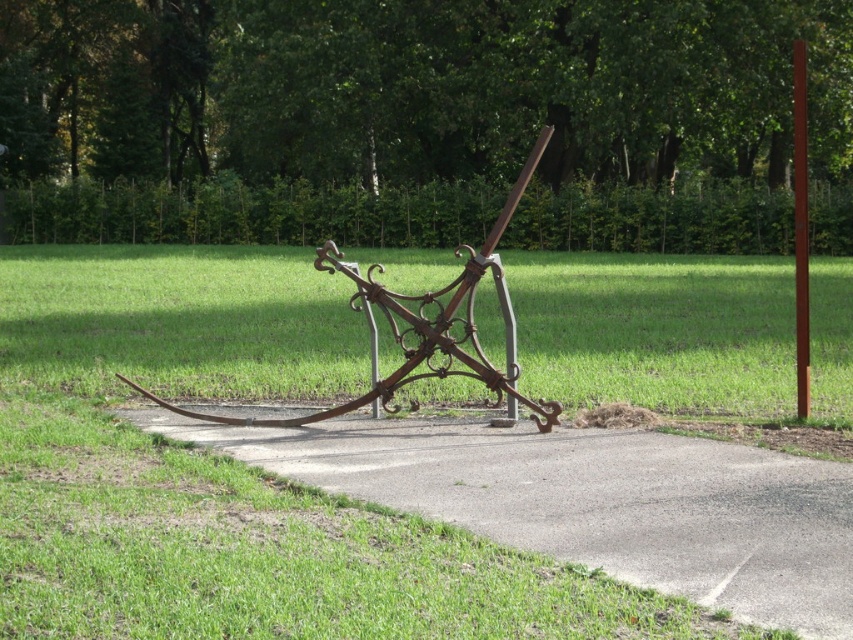
Which is more to the left, gray concrete pavement at center or smooth brown pole at right?

Positioned to the left is gray concrete pavement at center.

Does point (426, 435) come closer to viewer compared to point (795, 172)?

Yes, point (426, 435) is closer to viewer.

The image size is (853, 640). What are the coordinates of `gray concrete pavement at center` in the screenshot? It's located at (592, 500).

Is gray concrete pavement at center to the right of rusty wrought iron sculpture at center from the viewer's perspective?

Correct, you'll find gray concrete pavement at center to the right of rusty wrought iron sculpture at center.

Does gray concrete pavement at center appear over rusty wrought iron sculpture at center?

No, gray concrete pavement at center is not above rusty wrought iron sculpture at center.

Locate an element on the screen. gray concrete pavement at center is located at coordinates (592, 500).

Which of these two, rusty wrought iron sculpture at center or smooth brown pole at right, stands shorter?

With less height is rusty wrought iron sculpture at center.

Does rusty wrought iron sculpture at center have a larger size compared to smooth brown pole at right?

Incorrect, rusty wrought iron sculpture at center is not larger than smooth brown pole at right.

Locate an element on the screen. rusty wrought iron sculpture at center is located at coordinates (418, 326).